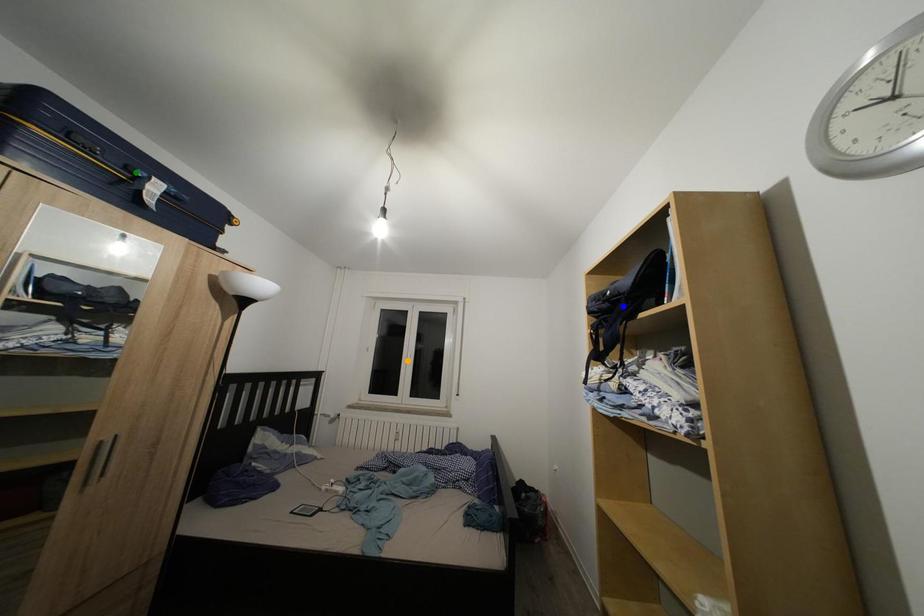
Order these from farthest to nearest:
1. green point
2. blue point
3. orange point

orange point
blue point
green point